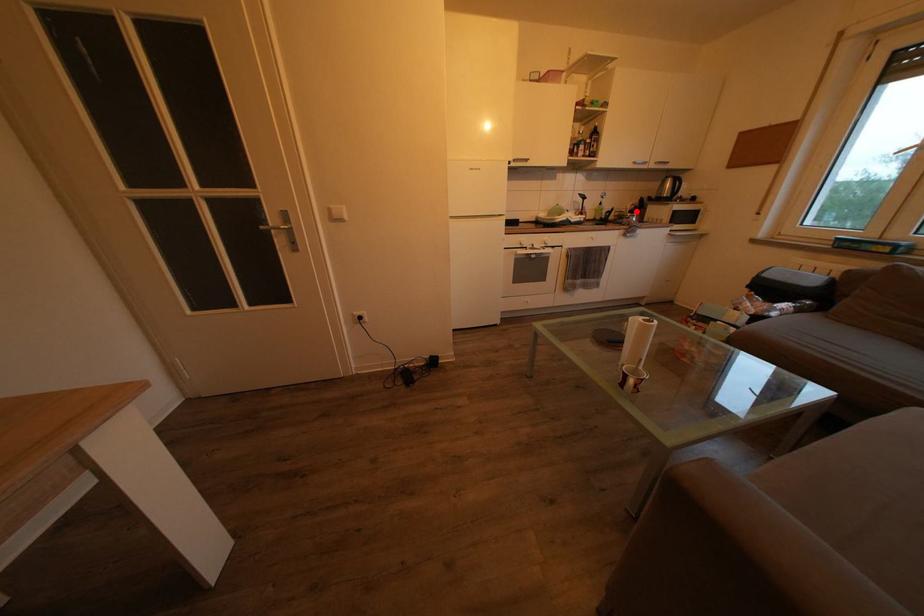
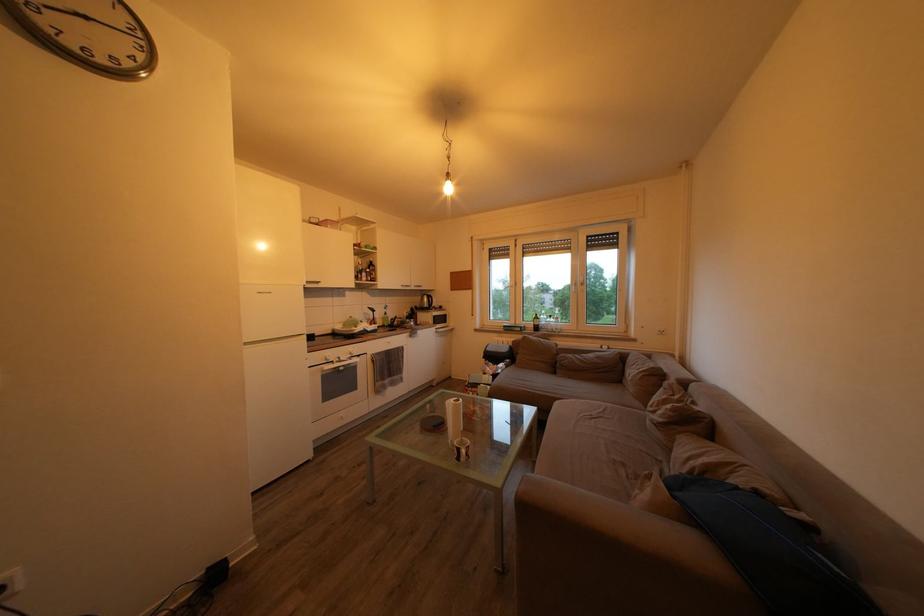
Find the pixel in the second image that matches the highlighted location in the first image.

(412, 318)